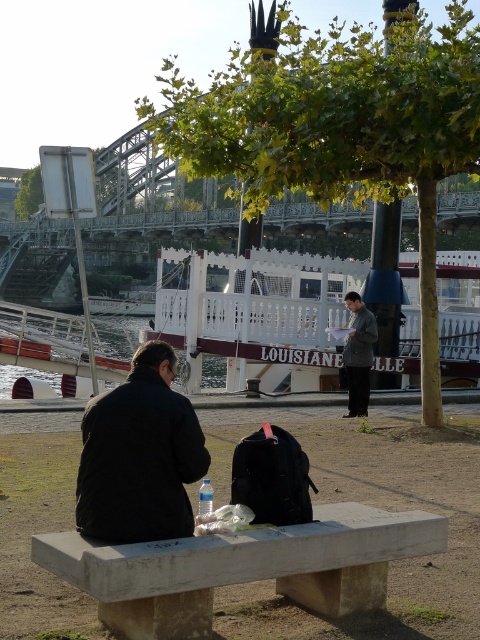
Question: Among these objects, which one is nearest to the camera?

Choices:
 (A) dark gray jacket at center
 (B) gray concrete bench at lower center
 (C) black matte jacket at lower left

Answer: (B)

Question: From the image, what is the correct spatial relationship of black matte jacket at lower left in relation to dark gray jacket at center?

Choices:
 (A) right
 (B) left

Answer: (B)

Question: Which object appears closest to the camera in this image?

Choices:
 (A) gray concrete bench at lower center
 (B) black matte jacket at lower left

Answer: (A)

Question: Does black matte jacket at lower left have a greater width compared to dark gray jacket at center?

Choices:
 (A) yes
 (B) no

Answer: (A)

Question: Which point is closer to the camera taking this photo?

Choices:
 (A) (300, 556)
 (B) (101, 468)

Answer: (A)

Question: Where is black matte jacket at lower left located in relation to dark gray jacket at center in the image?

Choices:
 (A) right
 (B) left

Answer: (B)